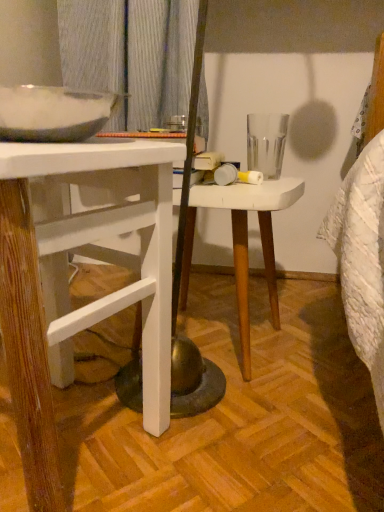
Question: Does white matte stool at center have a larger size compared to white wood desk at left?

Choices:
 (A) yes
 (B) no

Answer: (B)

Question: Is white matte stool at center looking in the opposite direction of white wood desk at left?

Choices:
 (A) no
 (B) yes

Answer: (A)

Question: Considering the relative sizes of white matte stool at center and white wood desk at left in the image provided, is white matte stool at center smaller than white wood desk at left?

Choices:
 (A) no
 (B) yes

Answer: (B)

Question: Does white matte stool at center have a lesser height compared to white wood desk at left?

Choices:
 (A) yes
 (B) no

Answer: (A)

Question: Does white matte stool at center contain white wood desk at left?

Choices:
 (A) yes
 (B) no

Answer: (B)

Question: Can you confirm if white matte stool at center is wider than white wood desk at left?

Choices:
 (A) no
 (B) yes

Answer: (A)

Question: Is white wood desk at left facing away from white matte stool at center?

Choices:
 (A) no
 (B) yes

Answer: (A)

Question: From the image's perspective, is white wood desk at left over white matte stool at center?

Choices:
 (A) no
 (B) yes

Answer: (A)

Question: From a real-world perspective, is white wood desk at left on top of white matte stool at center?

Choices:
 (A) no
 (B) yes

Answer: (B)

Question: Is there a large distance between white wood desk at left and white matte stool at center?

Choices:
 (A) no
 (B) yes

Answer: (A)

Question: Can you confirm if white wood desk at left is shorter than white matte stool at center?

Choices:
 (A) no
 (B) yes

Answer: (A)

Question: Can you confirm if white wood desk at left is positioned to the right of white matte stool at center?

Choices:
 (A) no
 (B) yes

Answer: (A)

Question: Would you say white matte stool at center is to the left or to the right of white wood desk at left in the picture?

Choices:
 (A) left
 (B) right

Answer: (B)